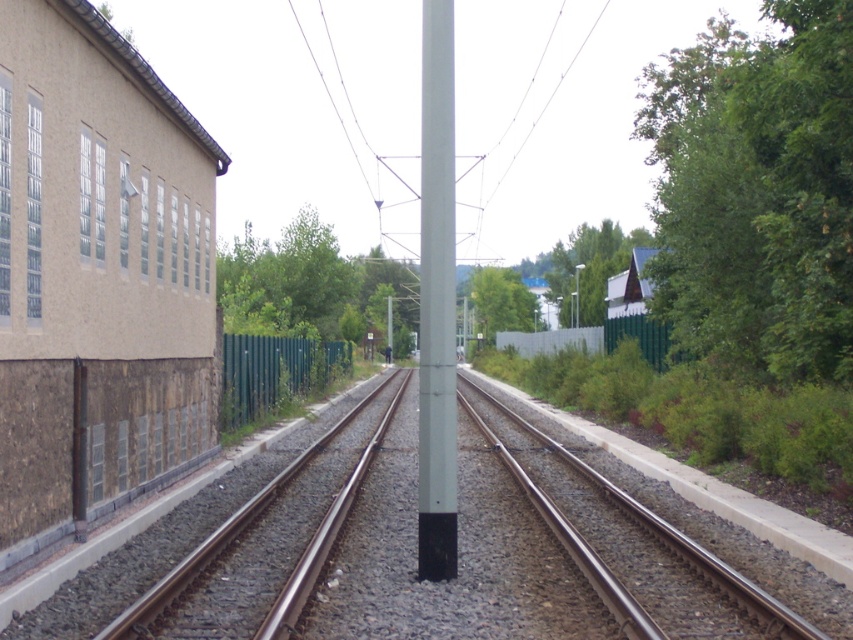
Question: Does green leafy tree at right have a smaller size compared to green leafy tree at upper center?

Choices:
 (A) yes
 (B) no

Answer: (B)

Question: Is brown gravel train track at center above metallic smooth train track at right?

Choices:
 (A) no
 (B) yes

Answer: (A)

Question: Considering the real-world distances, which object is closest to the metallic smooth train track at right?

Choices:
 (A) green leafy tree at center
 (B) metallic pole at center
 (C) green leafy tree at upper center

Answer: (C)

Question: Which object is the closest to the brown metal train track at center?

Choices:
 (A) green leafy tree at right
 (B) green leafy tree at upper center

Answer: (A)

Question: In this image, where is brown metal train track at center located relative to green leafy tree at upper center?

Choices:
 (A) left
 (B) right

Answer: (A)

Question: Among these objects, which one is nearest to the camera?

Choices:
 (A) brown gravel train track at center
 (B) green leafy tree at center
 (C) metallic pole at center
 (D) brown metal train track at center

Answer: (A)